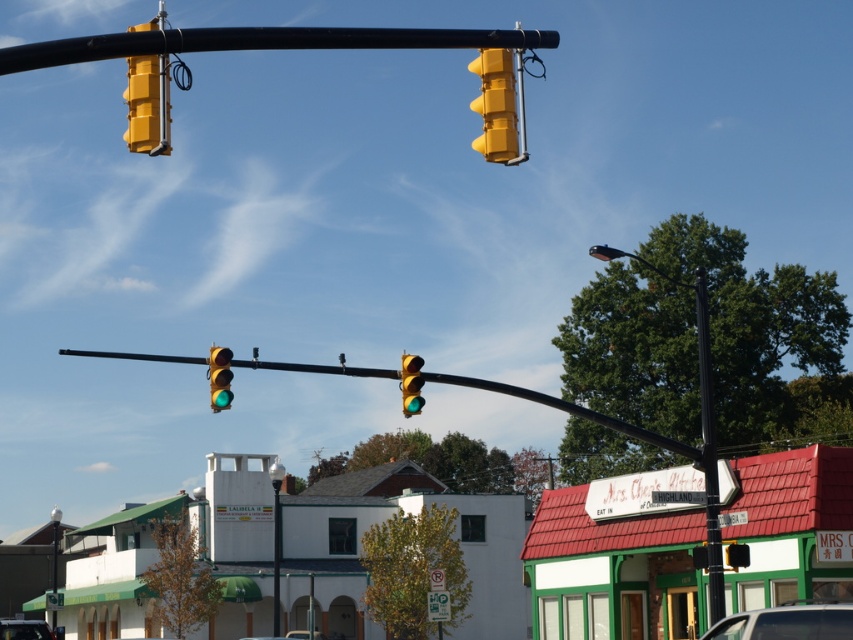
Does black metal street light at upper right appear under yellow matte traffic light at upper left?

Yes, black metal street light at upper right is below yellow matte traffic light at upper left.

Can you confirm if black metal street light at upper right is shorter than yellow matte traffic light at upper left?

Yes, black metal street light at upper right is shorter than yellow matte traffic light at upper left.

Identify the location of black metal street light at upper right. This screenshot has width=853, height=640. (701, 426).

The height and width of the screenshot is (640, 853). Find the location of `black metal street light at upper right`. black metal street light at upper right is located at coordinates (701, 426).

Between black metal pole at upper center and yellow plastic traffic light at upper center, which one has less height?

With less height is yellow plastic traffic light at upper center.

Is black metal pole at upper center closer to camera compared to yellow plastic traffic light at upper center?

Yes, black metal pole at upper center is in front of yellow plastic traffic light at upper center.

Which is in front, point (202, 45) or point (724, 547)?

Positioned in front is point (202, 45).

This screenshot has width=853, height=640. Identify the location of black metal pole at upper center. (260, 42).

Who is more forward, (309, 44) or (38, 630)?

Point (309, 44) is more forward.

Between point (68, 38) and point (24, 624), which one is positioned behind?

Point (68, 38)

Where is `black metal pole at upper center`? Image resolution: width=853 pixels, height=640 pixels. black metal pole at upper center is located at coordinates (260, 42).

At what (x,y) coordinates should I click in order to perform the action: click on black metal pole at upper center. Please return your answer as a coordinate pair (x, y). The image size is (853, 640). Looking at the image, I should click on (260, 42).